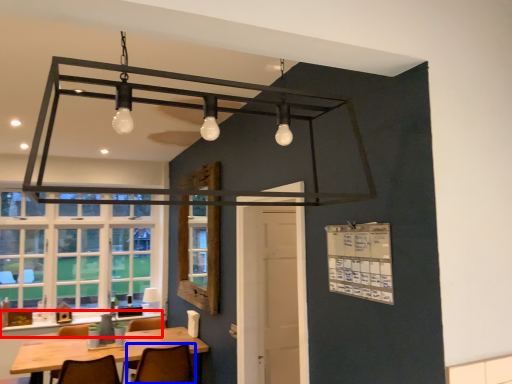
Question: Which object appears closest to the camera in this image, counter top (highlighted by a red box) or chair (highlighted by a blue box)?

Choices:
 (A) counter top
 (B) chair

Answer: (B)